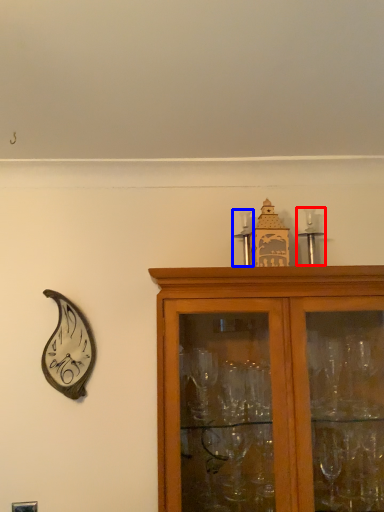
Question: Among these objects, which one is farthest to the camera, candle holder (highlighted by a red box) or candle holder (highlighted by a blue box)?

Choices:
 (A) candle holder
 (B) candle holder

Answer: (A)